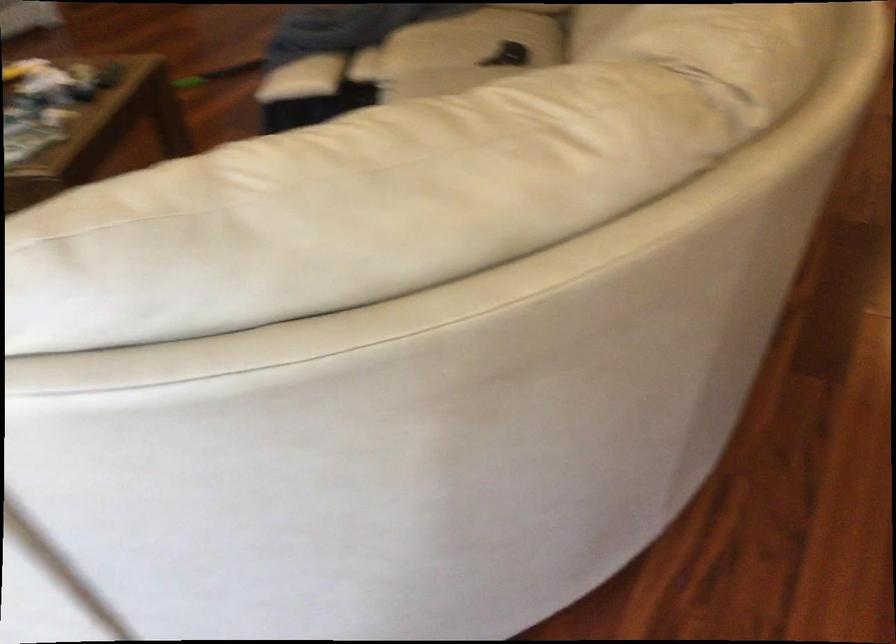
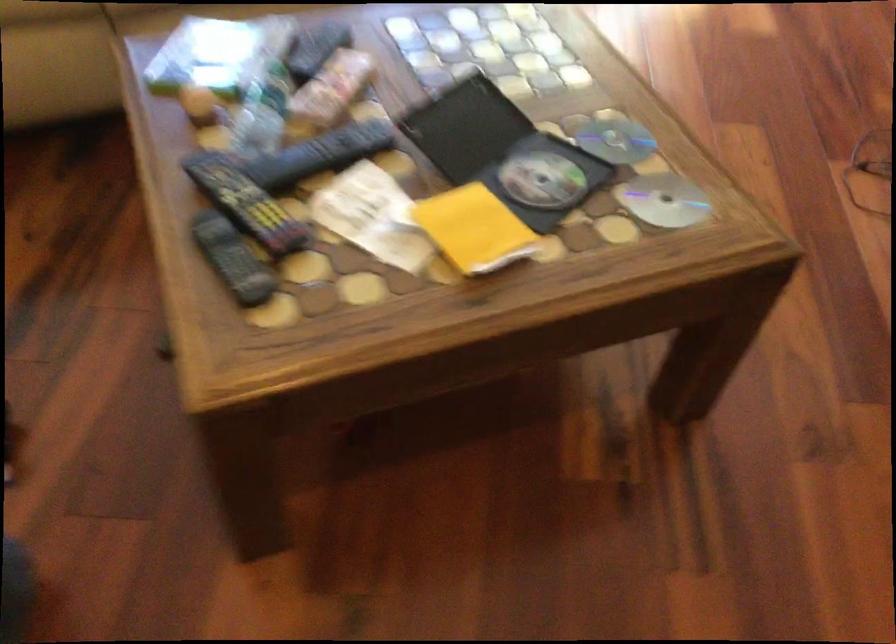
Locate, in the second image, the point that corresponds to the point at 79,80 in the first image.

(245, 202)